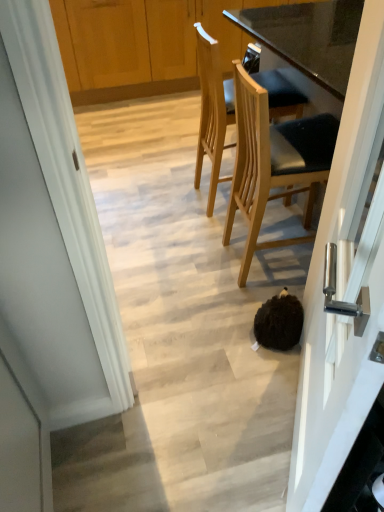
Find the location of `free space to the left of light wood/texture chair at upper center, arranged as the first chair when viewed from the back`. free space to the left of light wood/texture chair at upper center, arranged as the first chair when viewed from the back is located at coordinates (175, 196).